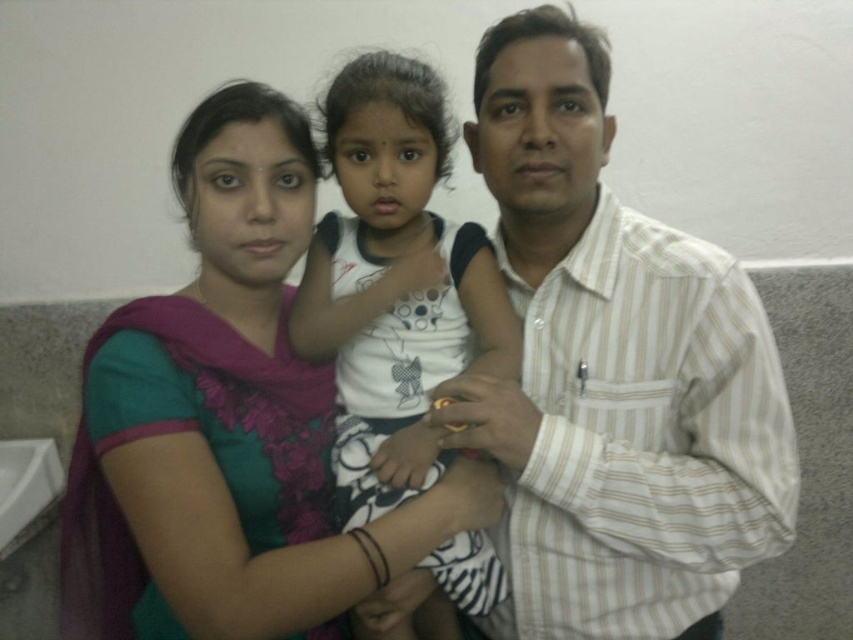
You are a photographer trying to capture a candid shot of the two adults and the child in the scene. You notice the white striped shirt at center and the white dotted shirt at center. Which of these shirts is positioned higher on the child?

The white striped shirt at center is located above the white dotted shirt at center, so the striped shirt is higher.

Based on the scene described, which object is taller between the white striped shirt at center and the green fabric sari at center?

The white striped shirt at center is taller than the green fabric sari at center according to the description.